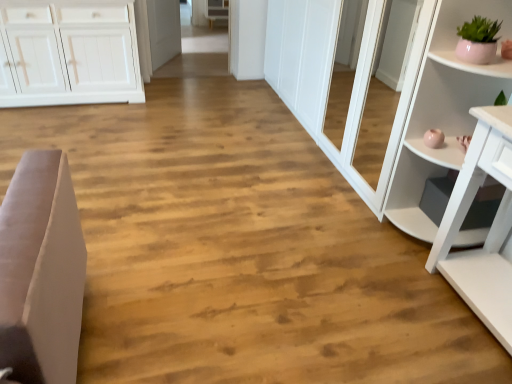
Question: Considering the positions of matte pink pot at upper right and white glossy door at center in the image, is matte pink pot at upper right wider or thinner than white glossy door at center?

Choices:
 (A) thin
 (B) wide

Answer: (B)

Question: Which is correct: matte pink pot at upper right is inside white glossy door at center, or outside of it?

Choices:
 (A) outside
 (B) inside

Answer: (A)

Question: Which is nearer to the white wood cabinet at upper center?

Choices:
 (A) white glossy shelf at right
 (B) matte pink pot at upper right
 (C) white glossy door at center

Answer: (C)

Question: Considering the real-world distances, which object is farthest from the white wood cabinet at upper center?

Choices:
 (A) white glossy shelf at right
 (B) white glossy door at center
 (C) matte pink pot at upper right

Answer: (C)